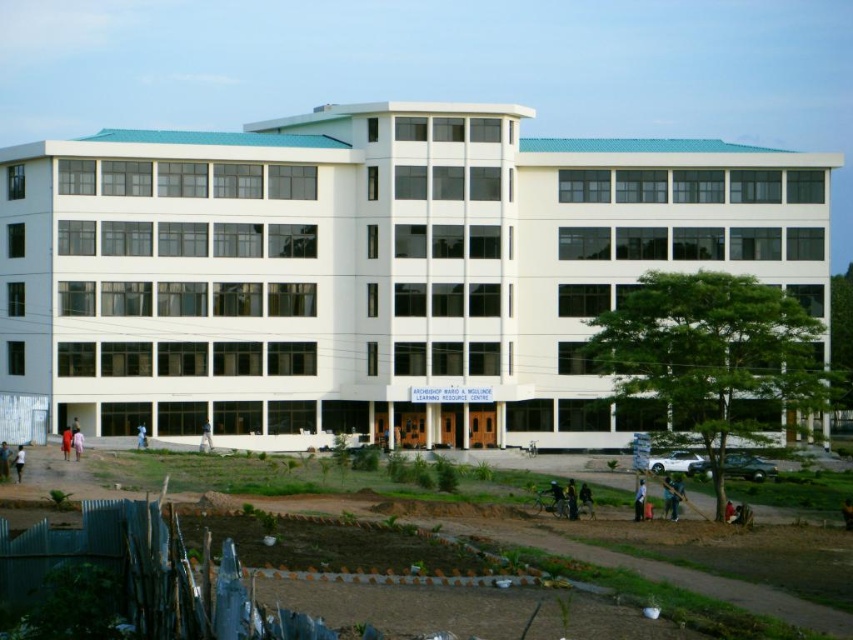
You are standing at the entrance of the Archbishop Mario A. Mullinoc Learning Resource Centre and see a black fabric person at lower right and a dark skin person at lower left. Which person is nearer to you?

The black fabric person at lower right is closer to the viewer than the dark skin person at lower left.

You are standing at the entrance of the Archbishop Mario A. Mullinoc Learning Resource Centre and see a black fabric person at lower right and a light brown wooden stick at lower left. Which object is located to the right of the other?

The black fabric person at lower right is positioned on the right side of light brown wooden stick at lower left.